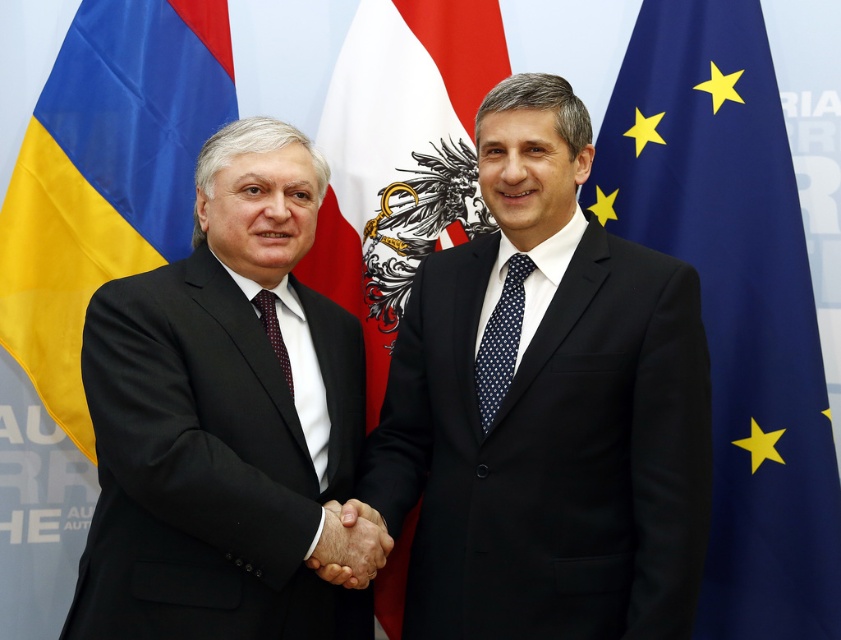
Does blue fabric flag at right appear over smooth skin handshake at center?

Yes.

Does blue fabric flag at right appear on the right side of smooth skin handshake at center?

Correct, you'll find blue fabric flag at right to the right of smooth skin handshake at center.

Between point (713, 196) and point (346, 582), which one is positioned in front?

Point (346, 582) is in front.

Where is `blue fabric flag at right`? This screenshot has height=640, width=841. blue fabric flag at right is located at coordinates (733, 301).

Which is above, white fabric flag at center or dark red textured tie at center?

white fabric flag at center

Who is more forward, (x=392, y=621) or (x=292, y=385)?

Positioned in front is point (x=292, y=385).

Where is `white fabric flag at center`? white fabric flag at center is located at coordinates (400, 156).

Which is more to the right, smooth skin handshake at center or dark red textured tie at center?

smooth skin handshake at center is more to the right.

Image resolution: width=841 pixels, height=640 pixels. What do you see at coordinates (350, 545) in the screenshot? I see `smooth skin handshake at center` at bounding box center [350, 545].

Identify the location of smooth skin handshake at center. (350, 545).